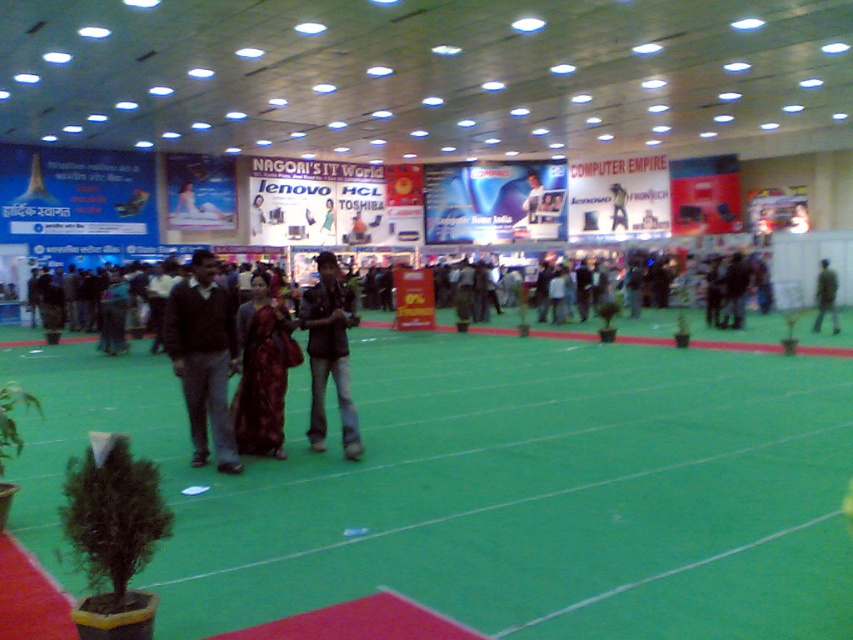
Looking at this image, which is more to the right, denim jacket at center or dark green fabric jacket at center?

Positioned to the right is dark green fabric jacket at center.

Is point (325, 298) more distant than point (833, 333)?

No, (325, 298) is in front of (833, 333).

Is point (343, 284) positioned in front of point (817, 317)?

Yes, point (343, 284) is in front of point (817, 317).

In order to click on denim jacket at center in this screenshot , I will do (329, 353).

Measure the distance between maroon silk saree at center and camera.

The distance of maroon silk saree at center from camera is 6.62 meters.

Between point (292, 358) and point (817, 288), which one is positioned behind?

The point (817, 288) is behind.

Which is behind, point (260, 372) or point (822, 266)?

The point (822, 266) is behind.

Where is `maroon silk saree at center`? This screenshot has height=640, width=853. maroon silk saree at center is located at coordinates (262, 371).

The image size is (853, 640). What do you see at coordinates (202, 358) in the screenshot?
I see `dark brown sweater at center` at bounding box center [202, 358].

Is dark brown sweater at center bigger than denim jacket at center?

Incorrect, dark brown sweater at center is not larger than denim jacket at center.

Who is more forward, (222, 420) or (347, 392)?

Point (222, 420) is more forward.

This screenshot has width=853, height=640. What are the coordinates of `dark brown sweater at center` in the screenshot? It's located at (202, 358).